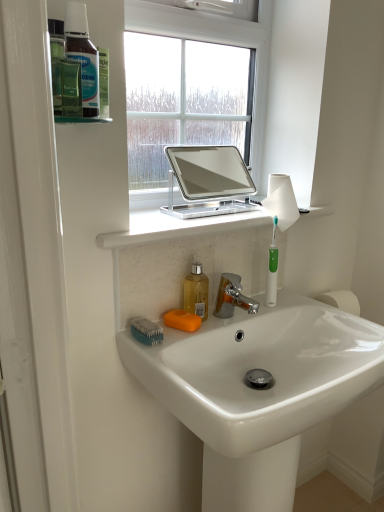
I want to click on spots to the right of orange matte soap at sink, so click(x=236, y=317).